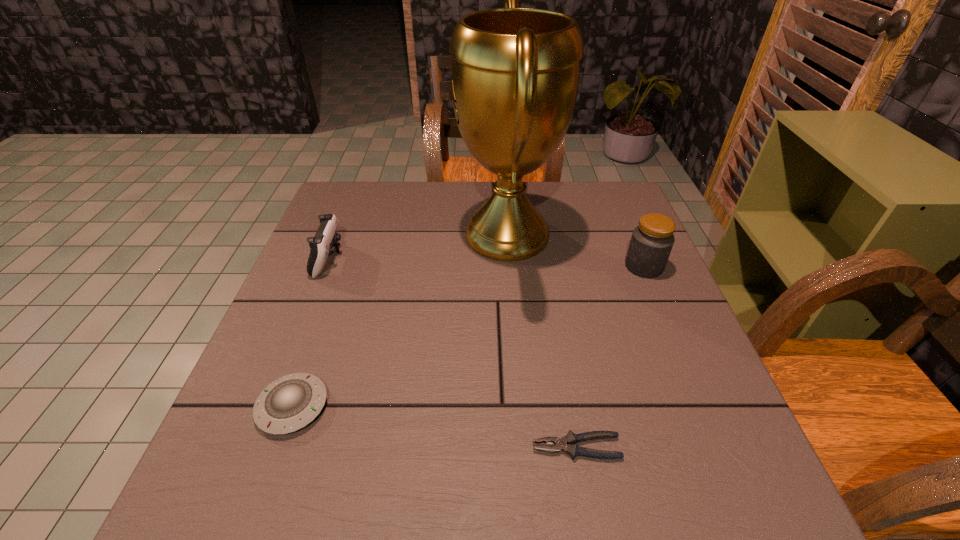
Find the location of a particular element. This screenshot has height=540, width=960. free space between the rightmost object and the trophy cup is located at coordinates (576, 251).

At what (x,y) coordinates should I click in order to perform the action: click on vacant space that's between the shortest object and the trophy cup. Please return your answer as a coordinate pair (x, y). Looking at the image, I should click on (541, 341).

You are a GUI agent. You are given a task and a screenshot of the screen. Output one action in this format:
    pyautogui.click(x=<x>, y=<y>)
    Task: Click on the empty space that is in between the trophy cup and the control
    Image resolution: width=960 pixels, height=540 pixels.
    Given the screenshot: What is the action you would take?
    pyautogui.click(x=419, y=247)

Image resolution: width=960 pixels, height=540 pixels. I want to click on free space between the trophy cup and the jar, so click(576, 251).

I want to click on free space between the saucer and the third tallest object, so click(x=311, y=333).

This screenshot has height=540, width=960. Identify the location of free spot between the trophy cup and the rightmost object. (576, 251).

Where is `free spot between the jar and the third tallest object`? This screenshot has height=540, width=960. free spot between the jar and the third tallest object is located at coordinates [487, 262].

Where is `unoccupied position between the saucer and the second tallest object`? The width and height of the screenshot is (960, 540). unoccupied position between the saucer and the second tallest object is located at coordinates (468, 336).

This screenshot has height=540, width=960. I want to click on object that is the closest one to the second shortest object, so click(321, 245).

Select which object appears as the third closest to the rightmost object. Please provide its 2D coordinates. Your answer should be formatted as a tuple, i.e. [(x, y)], where the tuple contains the x and y coordinates of a point satisfying the conditions above.

[(291, 402)]